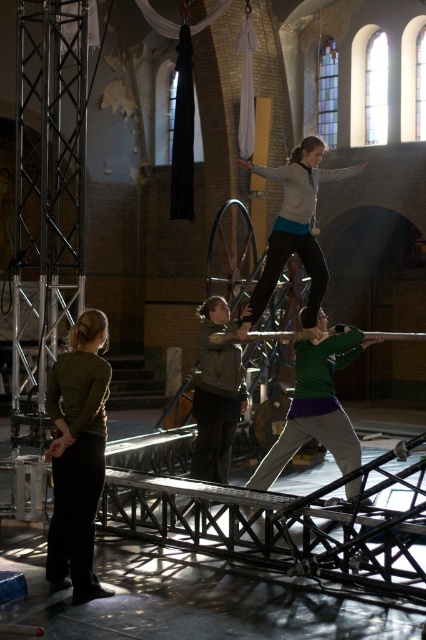
You are an audience member sitting in the front row of the circus performance. You notice two performers holding a pole with a woman balancing on it. Which performer is higher up between the gray sweater at center and the dark brown leather jacket at center?

The gray sweater at center is located above the dark brown leather jacket at center, so the performer in the gray sweater at center is higher up.

You are standing in the circus performance area and want to reach the point at coordinates point (347, 332). Can you walk directly to it?

The point (347, 332) is 12.34 meters away from the viewer, so yes, you can walk directly to it as it is within a reasonable distance.

Based on the coordinates provided, which performer is located at point (293, 227) in the image?

The point (293, 227) corresponds to the gray sweater at center.